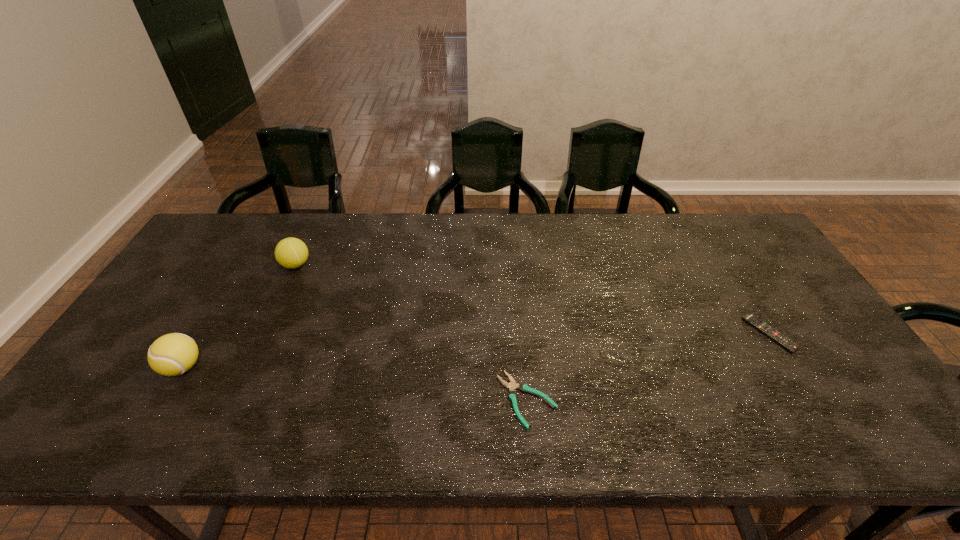
Where is `free spot between the second object from right to left and the third object from right to left`? This screenshot has width=960, height=540. free spot between the second object from right to left and the third object from right to left is located at coordinates (412, 333).

Identify the location of free space between the third object from left to right and the farther tennis ball. Image resolution: width=960 pixels, height=540 pixels. (412, 333).

Find the location of a particular element. The width and height of the screenshot is (960, 540). empty space that is in between the remote control and the second object from right to left is located at coordinates [x=648, y=367].

You are a GUI agent. You are given a task and a screenshot of the screen. Output one action in this format:
    pyautogui.click(x=<x>, y=<y>)
    Task: Click on the free space between the rightmost object and the second object from right to left
    The width and height of the screenshot is (960, 540).
    Given the screenshot: What is the action you would take?
    pyautogui.click(x=648, y=367)

Find the location of a particular element. The image size is (960, 540). free spot between the rightmost object and the right tennis ball is located at coordinates (533, 299).

The height and width of the screenshot is (540, 960). Find the location of `vacant region between the remote control and the third object from right to left`. vacant region between the remote control and the third object from right to left is located at coordinates (533, 299).

This screenshot has width=960, height=540. I want to click on unoccupied position between the rightmost object and the right tennis ball, so click(533, 299).

The width and height of the screenshot is (960, 540). Identify the location of vacant space in between the rightmost object and the pliers. (648, 367).

The image size is (960, 540). What are the coordinates of `vacant area that lies between the left tennis ball and the rightmost object` in the screenshot? It's located at (476, 350).

In order to click on object that is the second closest to the rightmost object in this screenshot , I will do `click(291, 253)`.